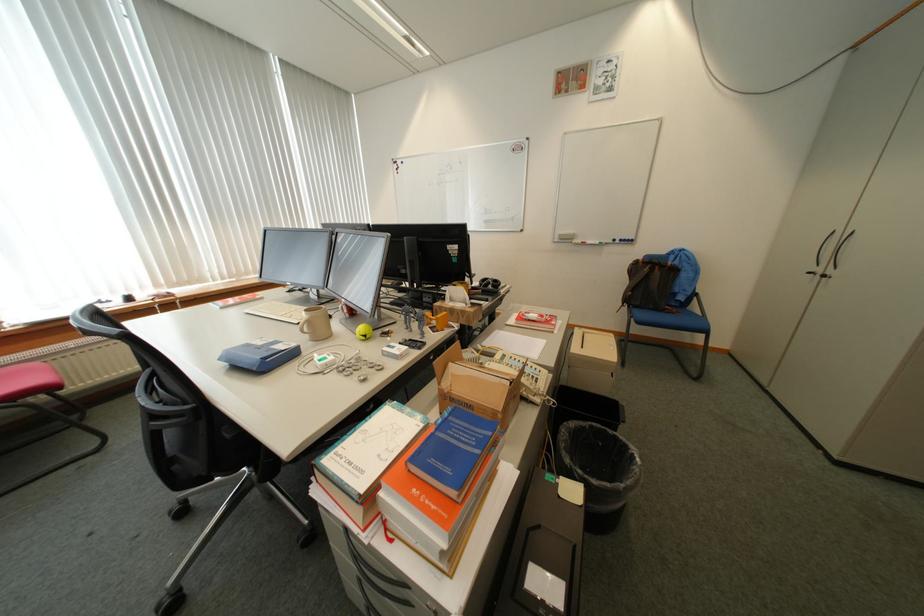
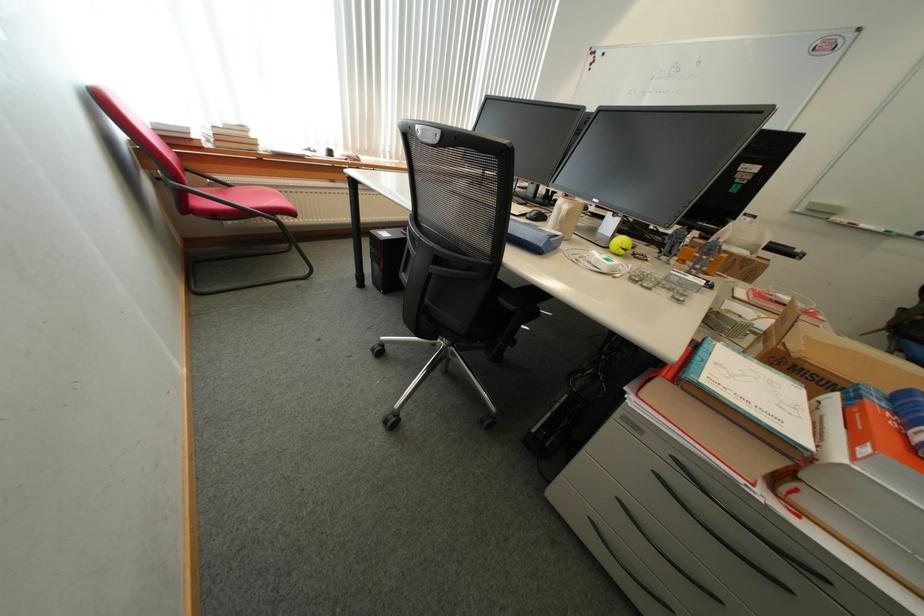
Find the pixel in the second image that matches (x=463, y=376) in the first image.

(816, 339)